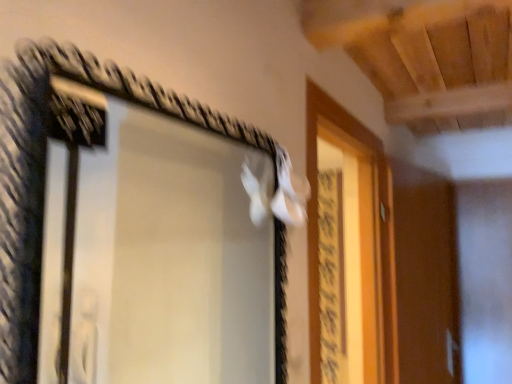
Image resolution: width=512 pixels, height=384 pixels. I want to click on black wire frame mirror at upper left, so click(x=155, y=254).

Describe the element at coordinates (155, 254) in the screenshot. The height and width of the screenshot is (384, 512). I see `black wire frame mirror at upper left` at that location.

In order to face black wire frame mirror at upper left, should I rotate leftwards or rightwards?

A 8.003 degree turn to the left will do.

Describe the element at coordinates (357, 247) in the screenshot. This screenshot has height=384, width=512. I see `white matte screen door at upper right` at that location.

Where is `white matte screen door at upper right`? white matte screen door at upper right is located at coordinates (357, 247).

I want to click on black wire frame mirror at upper left, so click(155, 254).

Would you say white matte screen door at upper right is to the left or to the right of black wire frame mirror at upper left in the picture?

Based on their positions, white matte screen door at upper right is located to the right of black wire frame mirror at upper left.

Relative to black wire frame mirror at upper left, is white matte screen door at upper right in front or behind?

In the image, white matte screen door at upper right appears behind black wire frame mirror at upper left.

Between point (364, 345) and point (80, 194), which one is positioned behind?

Positioned behind is point (364, 345).

From the image's perspective, is white matte screen door at upper right beneath black wire frame mirror at upper left?

Correct, white matte screen door at upper right appears lower than black wire frame mirror at upper left in the image.

From a real-world perspective, which is physically above, white matte screen door at upper right or black wire frame mirror at upper left?

black wire frame mirror at upper left, from a real-world perspective.

Which object is thinner, white matte screen door at upper right or black wire frame mirror at upper left?

Thinner between the two is black wire frame mirror at upper left.

Who is taller, white matte screen door at upper right or black wire frame mirror at upper left?

With more height is white matte screen door at upper right.

Who is smaller, white matte screen door at upper right or black wire frame mirror at upper left?

With smaller size is black wire frame mirror at upper left.

Is white matte screen door at upper right spatially inside black wire frame mirror at upper left, or outside of it?

The correct answer is: outside.

Would you say white matte screen door at upper right is a long distance from black wire frame mirror at upper left?

That's not correct — white matte screen door at upper right is a little close to black wire frame mirror at upper left.

Is white matte screen door at upper right turned away from black wire frame mirror at upper left?

No, black wire frame mirror at upper left is not at the back of white matte screen door at upper right.

How different are the orientations of white matte screen door at upper right and black wire frame mirror at upper left in degrees?

The angle between the facing direction of white matte screen door at upper right and the facing direction of black wire frame mirror at upper left is 1.63 degrees.

Identify the location of window that appears on the left of white matte screen door at upper right. The width and height of the screenshot is (512, 384). (155, 254).

Does black wire frame mirror at upper left appear on the right side of white matte screen door at upper right?

No.

Which object is closer to the camera, black wire frame mirror at upper left or white matte screen door at upper right?

black wire frame mirror at upper left.

Which is closer to the camera, (x=86, y=312) or (x=362, y=273)?

Positioned in front is point (x=86, y=312).

From the image's perspective, is black wire frame mirror at upper left located above or below white matte screen door at upper right?

Clearly, from the image's perspective, black wire frame mirror at upper left is above white matte screen door at upper right.

From a real-world perspective, who is located higher, black wire frame mirror at upper left or white matte screen door at upper right?

In real-world perspective, black wire frame mirror at upper left is above.

Is black wire frame mirror at upper left wider than white matte screen door at upper right?

No, black wire frame mirror at upper left is not wider than white matte screen door at upper right.

In terms of height, does black wire frame mirror at upper left look taller or shorter compared to white matte screen door at upper right?

Clearly, black wire frame mirror at upper left is shorter compared to white matte screen door at upper right.

Between black wire frame mirror at upper left and white matte screen door at upper right, which one has larger size?

Bigger between the two is white matte screen door at upper right.

Is white matte screen door at upper right surrounded by black wire frame mirror at upper left?

No, white matte screen door at upper right is located outside of black wire frame mirror at upper left.

Is black wire frame mirror at upper left positioned far away from white matte screen door at upper right?

No, black wire frame mirror at upper left is not far away from white matte screen door at upper right.

Is black wire frame mirror at upper left positioned with its back to white matte screen door at upper right?

That's not correct — black wire frame mirror at upper left is not looking away from white matte screen door at upper right.

How many degrees apart are the facing directions of black wire frame mirror at upper left and white matte screen door at upper right?

1.63 degrees.

Could you measure the distance between black wire frame mirror at upper left and white matte screen door at upper right?

A distance of 25.21 inches exists between black wire frame mirror at upper left and white matte screen door at upper right.

Where is `window to the left of white matte screen door at upper right`? The height and width of the screenshot is (384, 512). window to the left of white matte screen door at upper right is located at coordinates (155, 254).

Find the location of `window located above the white matte screen door at upper right (from a real-world perspective)`. window located above the white matte screen door at upper right (from a real-world perspective) is located at coordinates (155, 254).

What are the coordinates of `screen door behind the black wire frame mirror at upper left` in the screenshot? It's located at (357, 247).